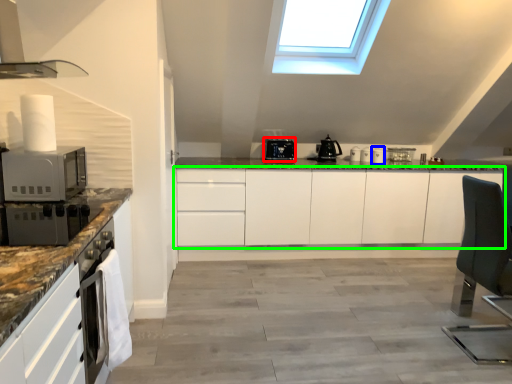
Question: Estimate the real-world distances between objects in this image. Which object is closer to kitchen appliance (highlighted by a red box), appliance (highlighted by a blue box) or cabinetry (highlighted by a green box)?

Choices:
 (A) appliance
 (B) cabinetry

Answer: (B)